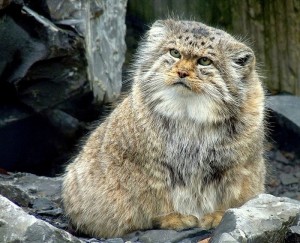
Find the location of a particular element. This screenshot has height=243, width=300. wood panel is located at coordinates (261, 30).